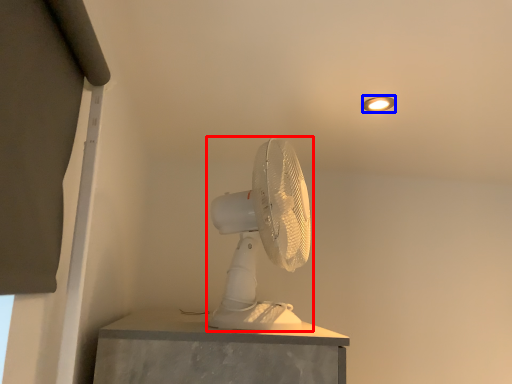
Question: Among these objects, which one is nearest to the camera, mechanical fan (highlighted by a red box) or light fixture (highlighted by a blue box)?

Choices:
 (A) mechanical fan
 (B) light fixture

Answer: (A)